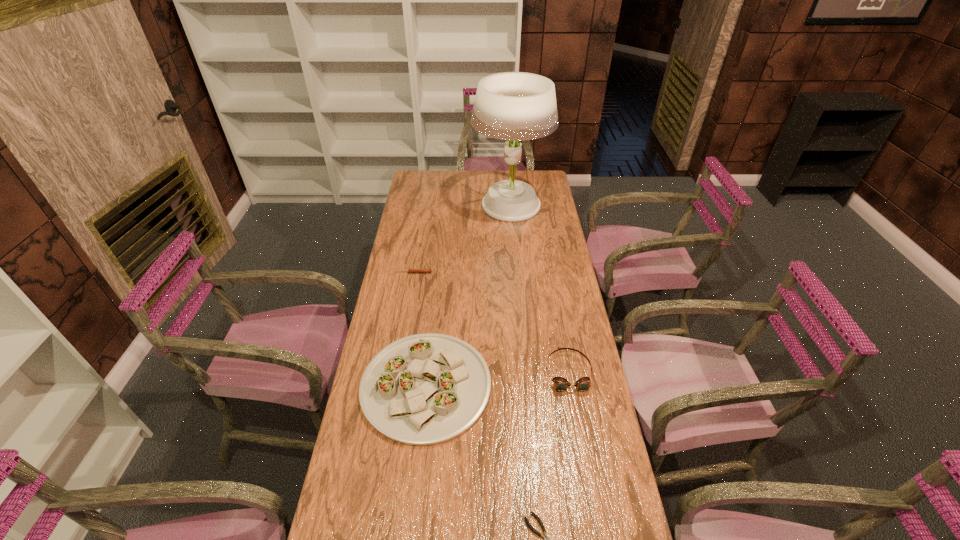
Where is `vacant area located 0.380m through the lenses of the goggles`? The height and width of the screenshot is (540, 960). vacant area located 0.380m through the lenses of the goggles is located at coordinates (595, 523).

In order to click on vacant area located on the right of the sausage in this screenshot , I will do `click(497, 273)`.

What are the coordinates of `object at the far edge` in the screenshot? It's located at (515, 106).

Identify the location of platter that is at the left edge. The width and height of the screenshot is (960, 540). (424, 389).

Locate an element on the screen. Image resolution: width=960 pixels, height=540 pixels. sausage that is at the left edge is located at coordinates (410, 270).

The image size is (960, 540). Identify the location of lamp that is at the right edge. (515, 106).

Find the location of a particular element. This screenshot has height=540, width=960. goggles positioned at the right edge is located at coordinates (560, 384).

Locate an element on the screen. object situated at the far right corner is located at coordinates (515, 106).

Where is `vacant space at the far edge`? The image size is (960, 540). vacant space at the far edge is located at coordinates (474, 193).

In the image, there is a desktop. At what (x,y) coordinates should I click in order to perform the action: click on vacant area at the right edge. Please return your answer as a coordinate pair (x, y). The height and width of the screenshot is (540, 960). Looking at the image, I should click on (573, 377).